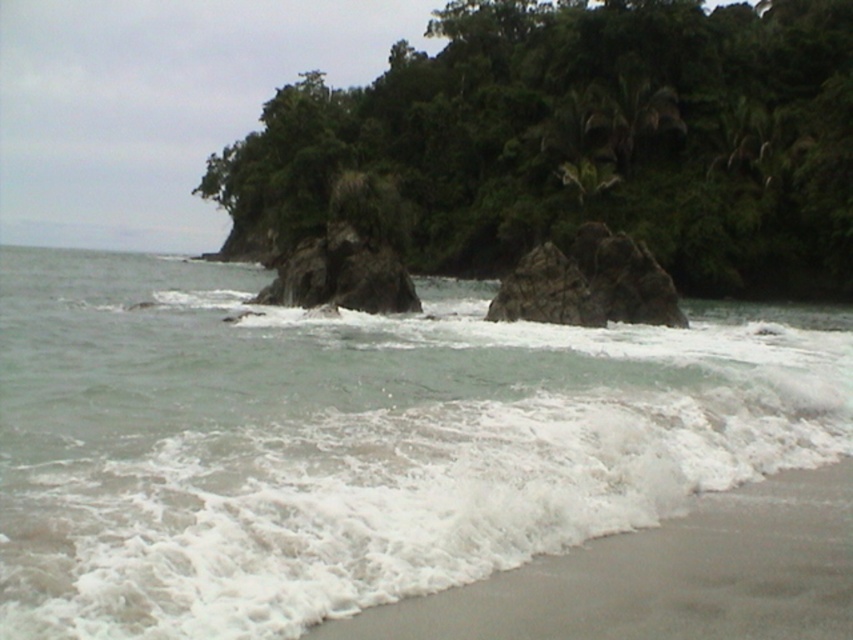
You are standing at the shoreline and want to cross to the other side. You have to step on the clear water at center and the gray sand at lower right. Which one should you choose to avoid getting wet?

The gray sand at lower right is the better choice to avoid getting wet because the clear water at center has a larger width, meaning it is deeper and more likely to get you wet.

You are standing on the beach and want to walk to the gray sand at lower right. Which direction should you move relative to the clear water at center?

To reach the gray sand at lower right, you should move downward from the clear water at center since the clear water at center is above the gray sand at lower right.